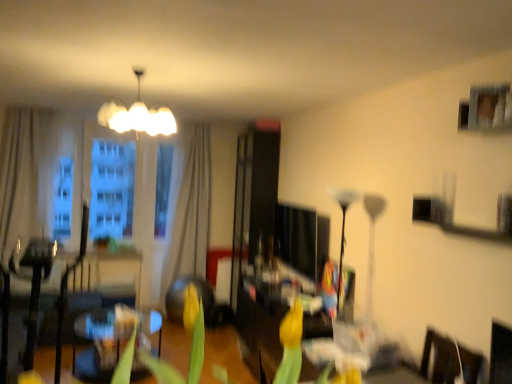
I want to click on beige fabric curtain at left, the second curtain positioned from the back, so click(19, 179).

I want to click on yellow matte tulip at center, so click(x=190, y=348).

The width and height of the screenshot is (512, 384). Describe the element at coordinates (137, 116) in the screenshot. I see `white glossy chandelier at upper center, which appears as the 2th lamp when viewed from the right` at that location.

What do you see at coordinates (30, 315) in the screenshot?
I see `dark brown leather armchair at left` at bounding box center [30, 315].

This screenshot has width=512, height=384. I want to click on black glass floor lamp at center, which is the 2th lamp in top-to-bottom order, so click(343, 229).

Which is more distant, (x=140, y=110) or (x=343, y=253)?

The point (x=343, y=253) is more distant.

Does white glossy chandelier at upper center, which appears as the 2th lamp when ordered from the bottom, have a smaller size compared to black glass floor lamp at center, which is the 2th lamp from left to right?

Incorrect, white glossy chandelier at upper center, which appears as the 2th lamp when ordered from the bottom, is not smaller in size than black glass floor lamp at center, which is the 2th lamp from left to right.

Locate an element on the screen. lamp below the white glossy chandelier at upper center, which appears as the 2th lamp when ordered from the bottom (from a real-world perspective) is located at coordinates (343, 229).

From a real-world perspective, is beige fabric curtain at left, the 1th curtain from the front, above or below white fabric curtain at center, the first curtain positioned from the right?

In terms of real-world spatial position, beige fabric curtain at left, the 1th curtain from the front, is above white fabric curtain at center, the first curtain positioned from the right.

Is beige fabric curtain at left, acting as the 1th curtain starting from the left, wider than white fabric curtain at center, arranged as the first curtain when viewed from the back?

Yes, beige fabric curtain at left, acting as the 1th curtain starting from the left, is wider than white fabric curtain at center, arranged as the first curtain when viewed from the back.

You are a GUI agent. You are given a task and a screenshot of the screen. Output one action in this format:
    pyautogui.click(x=<x>, y=<y>)
    Task: Click on the curtain that is above the white fabric curtain at center, the first curtain positioned from the right (from the image's perspective)
    This screenshot has height=384, width=512.
    Given the screenshot: What is the action you would take?
    pyautogui.click(x=19, y=179)

Which object is further away from the camera, black glass floor lamp at center, placed as the 1th lamp when sorted from bottom to top, or yellow matte tulip at center?

black glass floor lamp at center, placed as the 1th lamp when sorted from bottom to top, is further from the camera.

From the picture: Measure the distance between black glass floor lamp at center, which is the 2th lamp from left to right, and yellow matte tulip at center.

They are 5.22 feet apart.

Which of these two, black glass floor lamp at center, which is the 2th lamp from left to right, or yellow matte tulip at center, is bigger?

Bigger between the two is black glass floor lamp at center, which is the 2th lamp from left to right.

From a real-world perspective, is black glass floor lamp at center, placed as the 1th lamp when sorted from bottom to top, on yellow matte tulip at center?

No.

Which point is more forward, (9,162) or (294,358)?

The point (294,358) is more forward.

Is beige fabric curtain at left, which is the second curtain in right-to-left order, facing towards yellow matte tulip at center?

Yes, beige fabric curtain at left, which is the second curtain in right-to-left order, faces towards yellow matte tulip at center.

From the image's perspective, between beige fabric curtain at left, which is the second curtain in right-to-left order, and yellow matte tulip at center, which one is located above?

beige fabric curtain at left, which is the second curtain in right-to-left order, from the image's perspective.

Is beige fabric curtain at left, the second curtain positioned from the back, positioned far away from yellow matte tulip at center?

Yes, beige fabric curtain at left, the second curtain positioned from the back, and yellow matte tulip at center are quite far apart.

Can you tell me how much yellow matte tulip at center and white fabric curtain at center, the 2th curtain positioned from the front, differ in facing direction?

The angle between the facing direction of yellow matte tulip at center and the facing direction of white fabric curtain at center, the 2th curtain positioned from the front, is 179 degrees.

From a real-world perspective, is yellow matte tulip at center positioned under white fabric curtain at center, the second curtain viewed from the left, based on gravity?

Incorrect, from a real-world perspective, yellow matte tulip at center is higher than white fabric curtain at center, the second curtain viewed from the left.

Considering the positions of point (294, 383) and point (166, 271), is point (294, 383) closer or farther from the camera than point (166, 271)?

Point (294, 383) is positioned closer to the camera compared to point (166, 271).

Is yellow matte tulip at center not within white fabric curtain at center, arranged as the first curtain when viewed from the back?

Answer: Indeed, yellow matte tulip at center is completely outside white fabric curtain at center, arranged as the first curtain when viewed from the back.

Is there a large distance between white fabric curtain at center, the 2th curtain positioned from the front, and black glass floor lamp at center, placed as the 1th lamp when sorted from bottom to top?

Yes, white fabric curtain at center, the 2th curtain positioned from the front, and black glass floor lamp at center, placed as the 1th lamp when sorted from bottom to top, are located far from each other.

Does white fabric curtain at center, the first curtain positioned from the right, appear on the left side of black glass floor lamp at center, placed as the 1th lamp when sorted from bottom to top?

Yes, white fabric curtain at center, the first curtain positioned from the right, is to the left of black glass floor lamp at center, placed as the 1th lamp when sorted from bottom to top.

Does beige fabric curtain at left, which is the second curtain in right-to-left order, appear on the left side of black glass floor lamp at center, placed as the 1th lamp when sorted from bottom to top?

Yes.

Is beige fabric curtain at left, the 1th curtain from the front, thinner than black glass floor lamp at center, which is the 1th lamp in right-to-left order?

No.

How many degrees apart are the facing directions of beige fabric curtain at left, acting as the 1th curtain starting from the left, and black glass floor lamp at center, which is the 1th lamp in right-to-left order?

The facing directions of beige fabric curtain at left, acting as the 1th curtain starting from the left, and black glass floor lamp at center, which is the 1th lamp in right-to-left order, are 90 degrees apart.

How distant is beige fabric curtain at left, which is the second curtain in right-to-left order, from black glass floor lamp at center, which is the 1th lamp in right-to-left order?

They are 3.97 meters apart.

In the image, there is a black glass floor lamp at center, which is the 2th lamp from left to right. Identify the location of lamp above it (from the image's perspective). (137, 116).

Image resolution: width=512 pixels, height=384 pixels. I want to click on curtain located on the left of white fabric curtain at center, the first curtain positioned from the right, so click(19, 179).

Based on their spatial positions, is white glossy chandelier at upper center, which appears as the 2th lamp when viewed from the right, or white fabric curtain at center, the first curtain positioned from the right, further from dark brown leather armchair at left?

white glossy chandelier at upper center, which appears as the 2th lamp when viewed from the right.

Estimate the real-world distances between objects in this image. Which object is further from yellow matte tulip at center, white fabric curtain at center, arranged as the first curtain when viewed from the back, or white glossy chandelier at upper center, which appears as the 2th lamp when viewed from the right?

white fabric curtain at center, arranged as the first curtain when viewed from the back, is further to yellow matte tulip at center.

Estimate the real-world distances between objects in this image. Which object is further from white fabric curtain at center, the first curtain positioned from the right, white glossy chandelier at upper center, which appears as the 2th lamp when viewed from the right, or beige fabric curtain at left, the second curtain positioned from the back?

white glossy chandelier at upper center, which appears as the 2th lamp when viewed from the right.

Which object lies nearer to the anchor point yellow matte tulip at center, beige fabric curtain at left, which is the second curtain in right-to-left order, or black glass floor lamp at center, which is the 1th lamp in right-to-left order?

black glass floor lamp at center, which is the 1th lamp in right-to-left order, is closer to yellow matte tulip at center.

Which object lies further to the anchor point yellow matte tulip at center, white glossy chandelier at upper center, the 1th lamp from the top, or black glass floor lamp at center, which is the 2th lamp in top-to-bottom order?

white glossy chandelier at upper center, the 1th lamp from the top, is further to yellow matte tulip at center.

Based on the photo, estimate the real-world distances between objects in this image. Which object is closer to yellow matte tulip at center, beige fabric curtain at left, the second curtain positioned from the back, or white fabric curtain at center, arranged as the first curtain when viewed from the back?

The object closer to yellow matte tulip at center is white fabric curtain at center, arranged as the first curtain when viewed from the back.

From the image, which object appears to be nearer to white fabric curtain at center, the first curtain positioned from the right, dark brown leather armchair at left or black glass floor lamp at center, which is the 2th lamp in top-to-bottom order?

dark brown leather armchair at left is closer to white fabric curtain at center, the first curtain positioned from the right.

Which object lies further to the anchor point yellow matte tulip at center, beige fabric curtain at left, acting as the 1th curtain starting from the left, or white glossy chandelier at upper center, the 1th lamp from the top?

Among the two, beige fabric curtain at left, acting as the 1th curtain starting from the left, is located further to yellow matte tulip at center.

You are a GUI agent. You are given a task and a screenshot of the screen. Output one action in this format:
    pyautogui.click(x=<x>, y=<y>)
    Task: Click on the armchair between yellow matte tulip at center and white glossy chandelier at upper center, the 1th lamp from the top, along the z-axis
    
    Given the screenshot: What is the action you would take?
    pyautogui.click(x=30, y=315)

Image resolution: width=512 pixels, height=384 pixels. Identify the location of lamp located between yellow matte tulip at center and black glass floor lamp at center, placed as the 1th lamp when sorted from bottom to top, in the depth direction. (137, 116).

Image resolution: width=512 pixels, height=384 pixels. Find the location of `lamp situated between beige fabric curtain at left, which is the second curtain in right-to-left order, and black glass floor lamp at center, which is the 1th lamp in right-to-left order, from left to right`. lamp situated between beige fabric curtain at left, which is the second curtain in right-to-left order, and black glass floor lamp at center, which is the 1th lamp in right-to-left order, from left to right is located at coordinates (137, 116).

At what (x,y) coordinates should I click in order to perform the action: click on lamp between white glossy chandelier at upper center, the 1th lamp positioned from the left, and white fabric curtain at center, the second curtain viewed from the left, from front to back. Please return your answer as a coordinate pair (x, y). Looking at the image, I should click on (343, 229).